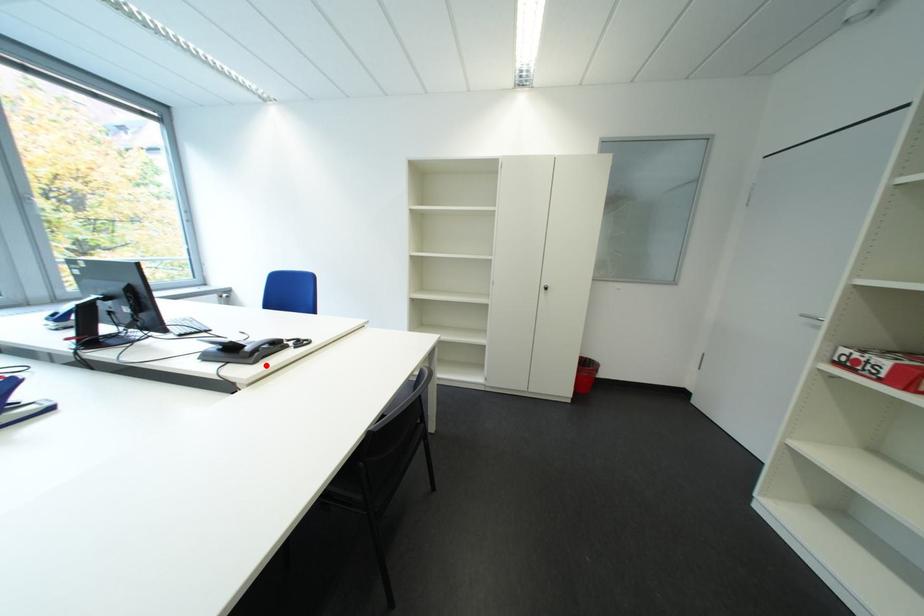
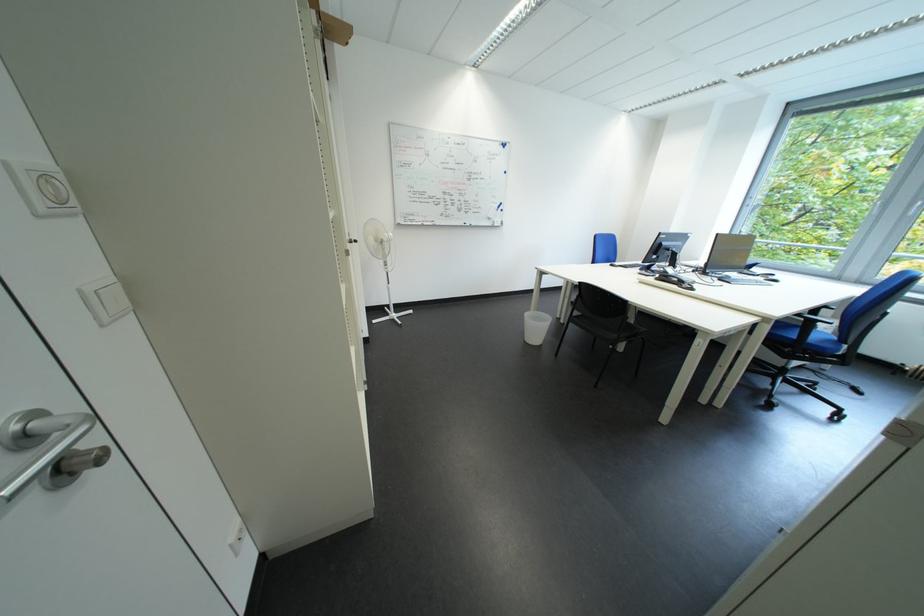
Question: I am providing you with two images of the same scene from different viewpoints. In image1, a red point is highlighted. Considering the same 3D point in image2, which of the following is correct?

Choices:
 (A) It is closer
 (B) It is farther

Answer: (A)